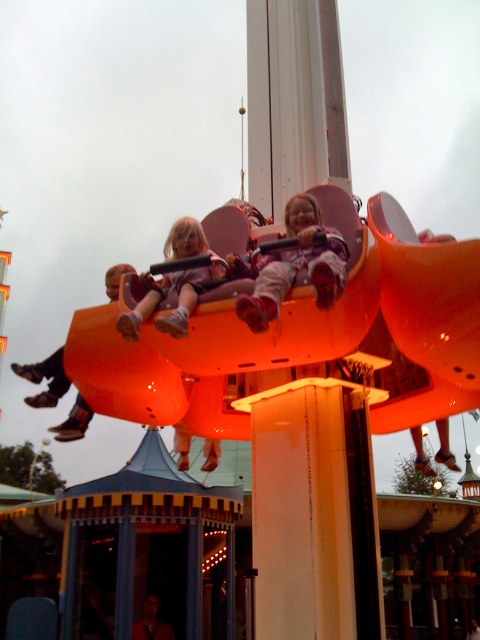
Question: Does orange glossy ride at center have a lesser width compared to matte purple seat at upper center?

Choices:
 (A) no
 (B) yes

Answer: (A)

Question: Can you confirm if orange glossy ride at center is thinner than matte purple seat at upper center?

Choices:
 (A) yes
 (B) no

Answer: (B)

Question: Which object is positioned farthest from the orange glossy ride at center?

Choices:
 (A) matte pink pants at center
 (B) matte purple seat at upper center

Answer: (B)

Question: Considering the relative positions of matte pink pants at center and matte purple seat at upper center in the image provided, where is matte pink pants at center located with respect to matte purple seat at upper center?

Choices:
 (A) above
 (B) below

Answer: (B)

Question: Which point is closer to the camera?

Choices:
 (A) matte pink pants at center
 (B) matte purple seat at upper center

Answer: (A)

Question: Which point is closer to the camera?

Choices:
 (A) orange glossy ride at center
 (B) matte pink pants at center
 (C) matte purple seat at upper center

Answer: (B)